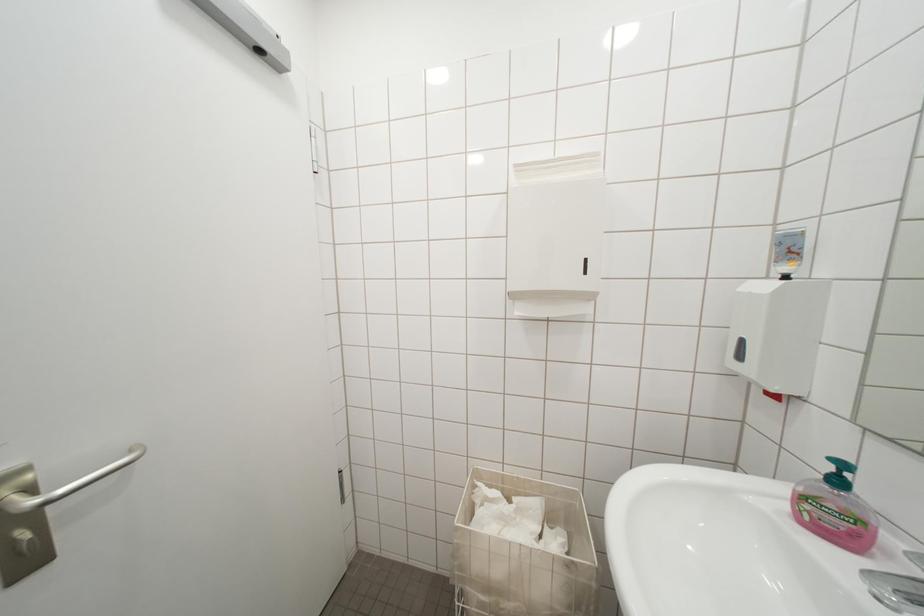
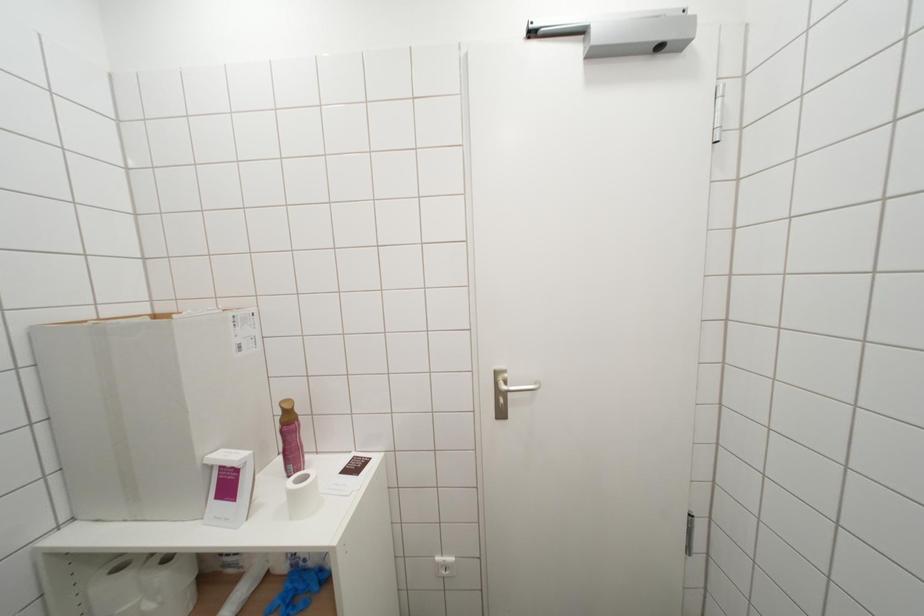
Question: How did the camera likely rotate?

Choices:
 (A) Left
 (B) Right
 (C) Up
 (D) Down

Answer: (A)